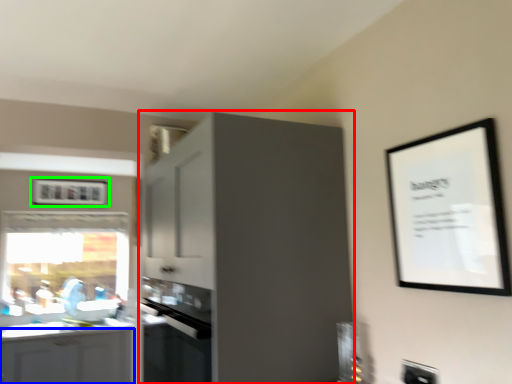
Question: Considering the real-world distances, which object is closest to cabinetry (highlighted by a red box)? cabinetry (highlighted by a blue box) or picture frame (highlighted by a green box).

Choices:
 (A) cabinetry
 (B) picture frame

Answer: (A)